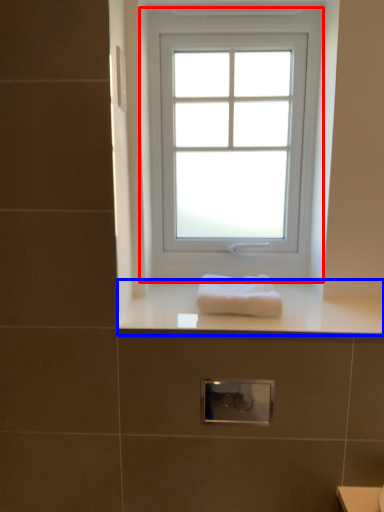
Question: Which of the following is the farthest to the observer, window (highlighted by a red box) or counter top (highlighted by a blue box)?

Choices:
 (A) window
 (B) counter top

Answer: (A)